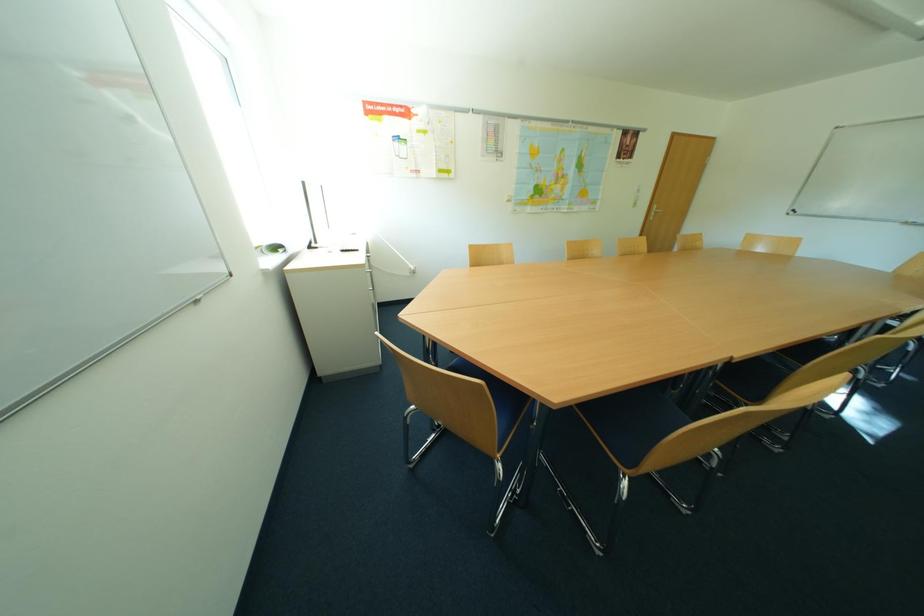
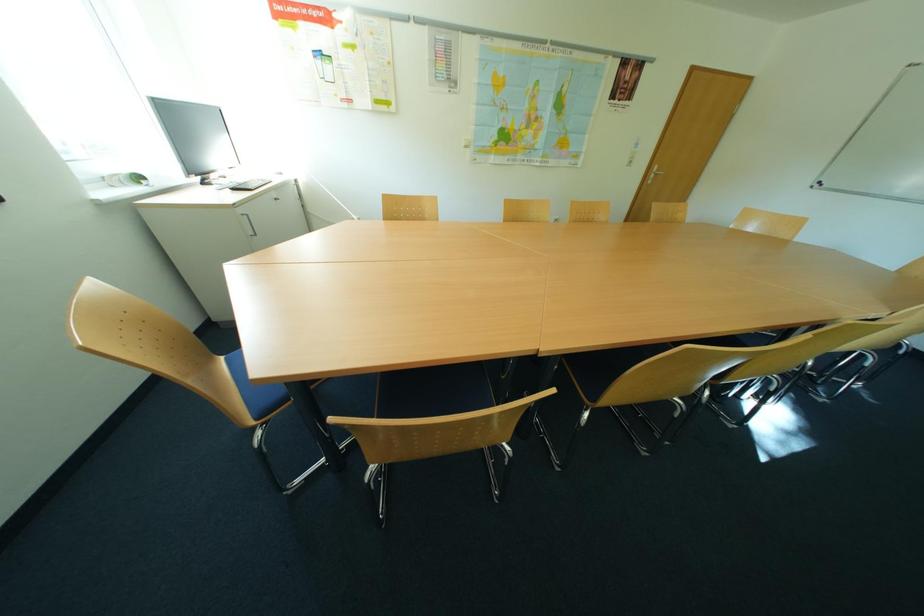
Question: In a continuous first-person perspective shot, in which direction is the camera moving?

Choices:
 (A) Left
 (B) Right
 (C) Forward
 (D) Backward

Answer: (B)